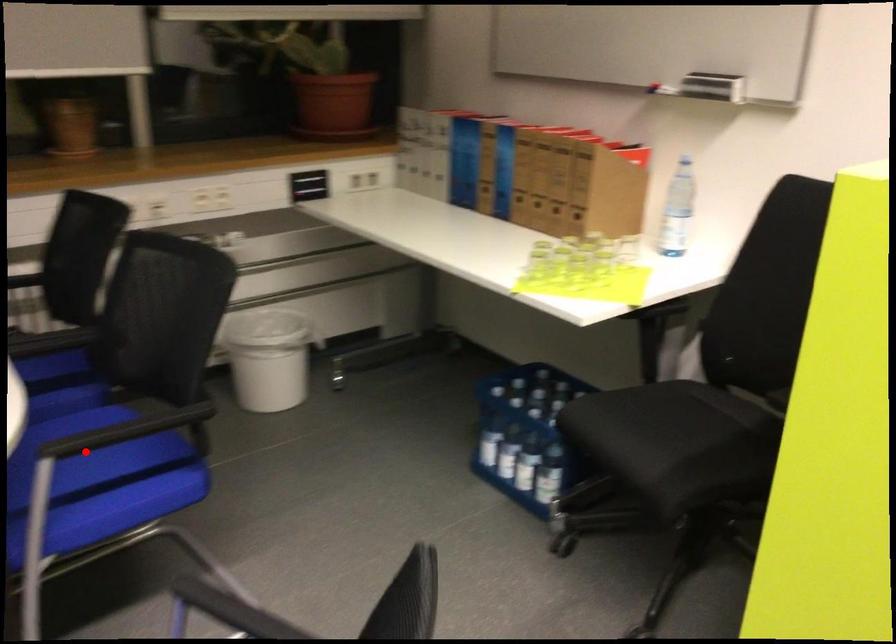
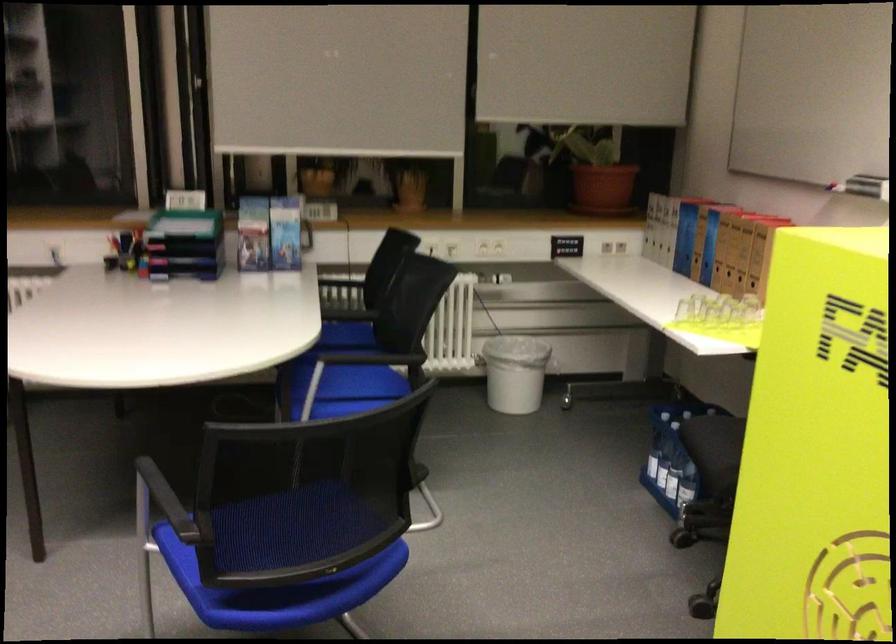
Where in the second image is the point corresponding to the highlighted location from the first image?

(349, 382)